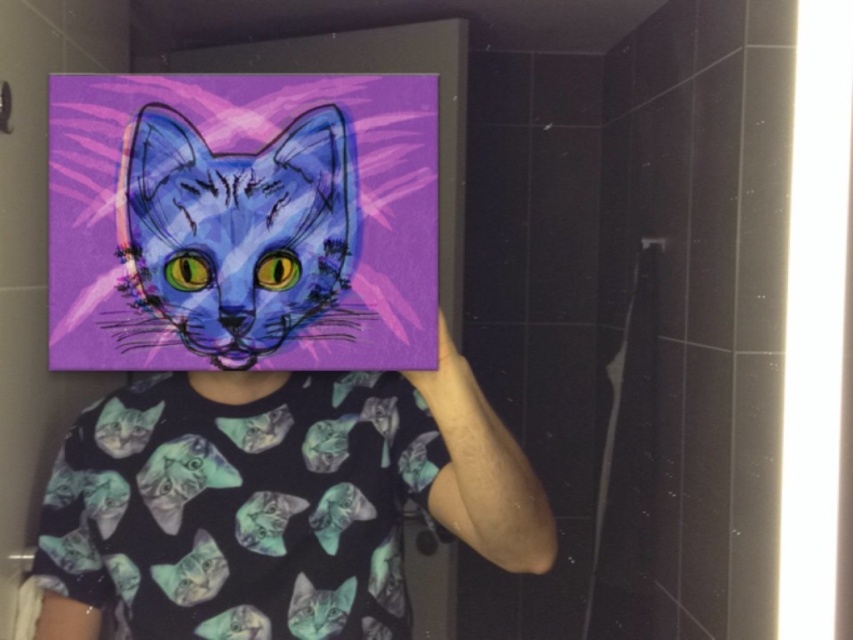
You are an art critic analyzing this bathroom scene. You notice the matte purple painting at upper center and the matte blue cat at upper left. Which object is closer to you?

The matte purple painting at upper center is closer to you because it is further to the viewer than the matte blue cat at upper left.

You are an interior designer assessing the placement of the matte purple painting at upper center and the matte blue cat at upper left in the bathroom scene. Based on their positions, which object is positioned more to the left?

The matte purple painting at upper center is positioned to the left of the matte blue cat at upper left, so the matte purple painting at upper center is more to the left.

Based on the photo, you are an interior designer assessing the bathroom layout. You see the matte purple painting at upper center and the matte blue cat at upper left. Which object is wider?

The matte purple painting at upper center is wider than the matte blue cat at upper left according to the description.